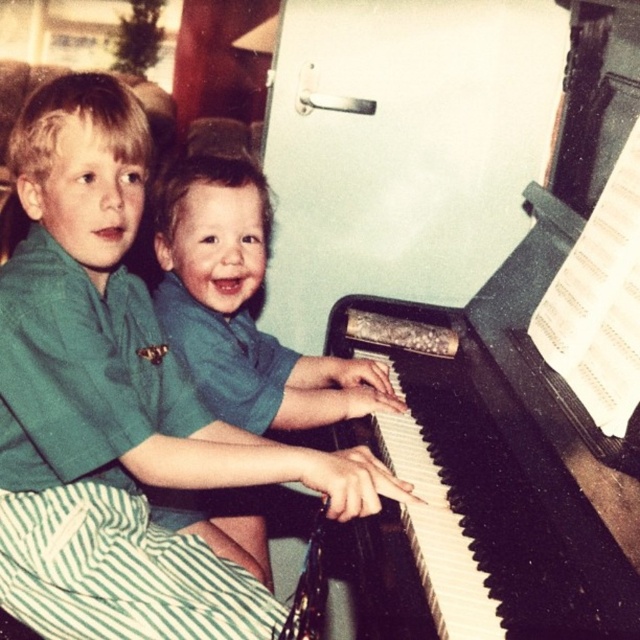
Based on the photo, you are standing in front of the scene and want to place a small stool exactly at the center of the image. Given the coordinates provided in the description, will the stool be placed on the black polished piano at center?

The black polished piano at center is located at point (504, 419), so placing the stool at the exact center coordinates would not align with the piano. The stool would be placed at the true center of the image, which may be a different location than where the piano is situated.

You are a photographer standing in front of the piano. You want to take a photo that clearly shows both the green cotton shirt at upper left and the green matte shirt at center. Which shirt will appear larger in the photo?

The green cotton shirt at upper left will appear larger in the photo because it is closer to the viewer than the green matte shirt at center.

You are a photographer trying to capture a photo of the black polished piano at center. There is a green cotton shirt at upper left in the way. Can you move the shirt to the right to get a clear shot of the piano?

The green cotton shirt at upper left is positioned on the left side of black polished piano at center. Moving it to the right would place it closer to the piano, potentially still blocking the view. Alternatively, moving it to the left might provide a clearer shot.